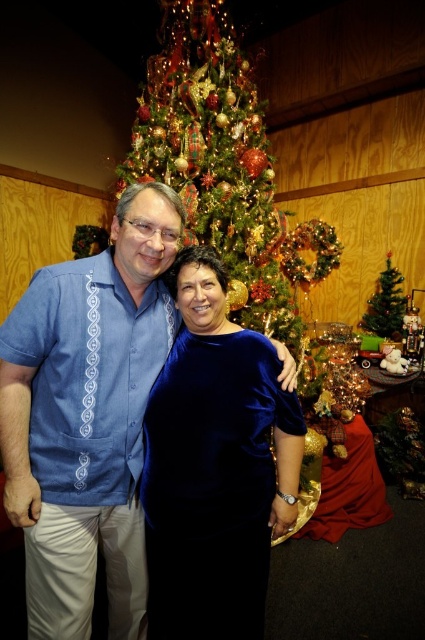
Question: Is blue satin blouse at center to the left of velvet blue dress at center from the viewer's perspective?

Choices:
 (A) yes
 (B) no

Answer: (A)

Question: Which of these objects is positioned farthest from the velvet blue dress at center?

Choices:
 (A) green matte christmas tree at center
 (B) blue satin blouse at center

Answer: (A)

Question: Which object appears closest to the camera in this image?

Choices:
 (A) velvet blue dress at center
 (B) blue satin blouse at center
 (C) green matte christmas tree at center

Answer: (B)

Question: Which object is farther from the camera taking this photo?

Choices:
 (A) blue satin blouse at center
 (B) velvet blue dress at center
 (C) green matte christmas tree at center

Answer: (C)

Question: Does blue satin blouse at center have a lesser width compared to velvet blue dress at center?

Choices:
 (A) no
 (B) yes

Answer: (B)

Question: Does blue satin blouse at center have a greater width compared to velvet blue dress at center?

Choices:
 (A) yes
 (B) no

Answer: (B)